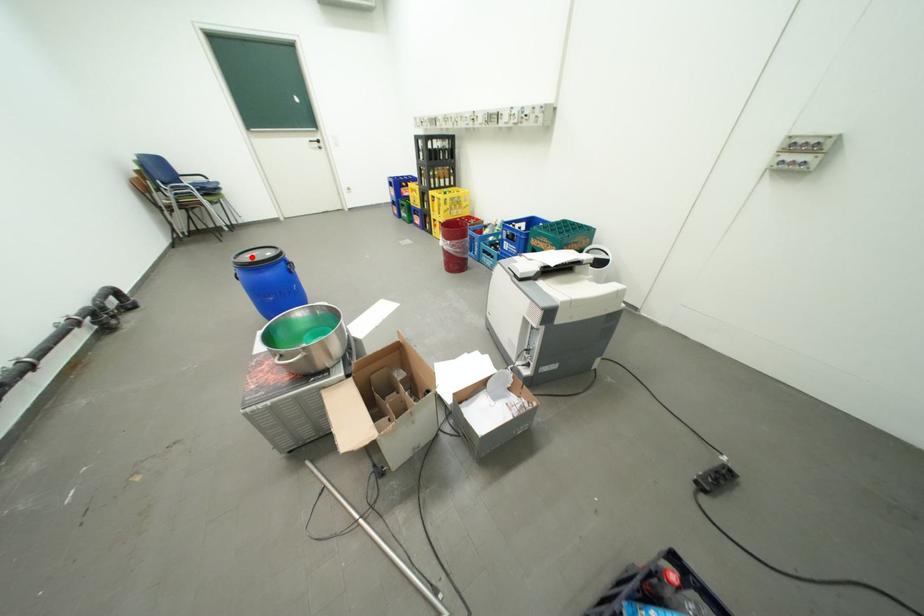
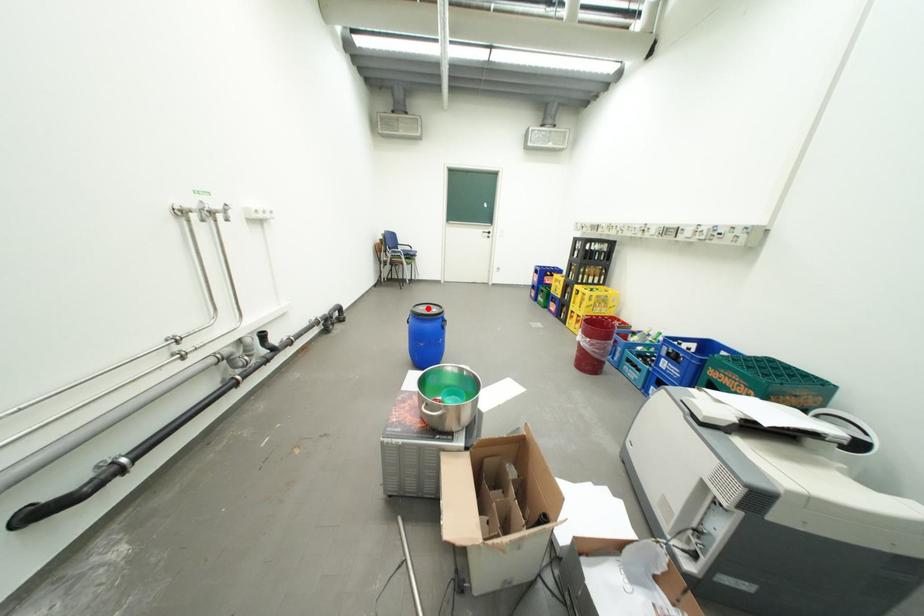
I am providing you with two images of the same scene from different viewpoints. A red point is marked on the first image and another point is marked on the second image. Is the red point in image1 aligned with the point shown in image2?

Yes